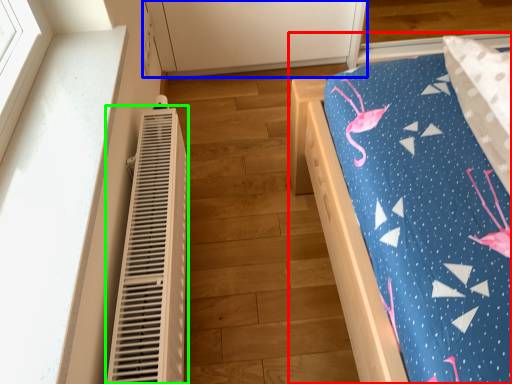
Question: Which object is the closest to the furniture (highlighted by a red box)? Choose among these: cabinetry (highlighted by a blue box) or heater (highlighted by a green box).

Choices:
 (A) cabinetry
 (B) heater

Answer: (B)